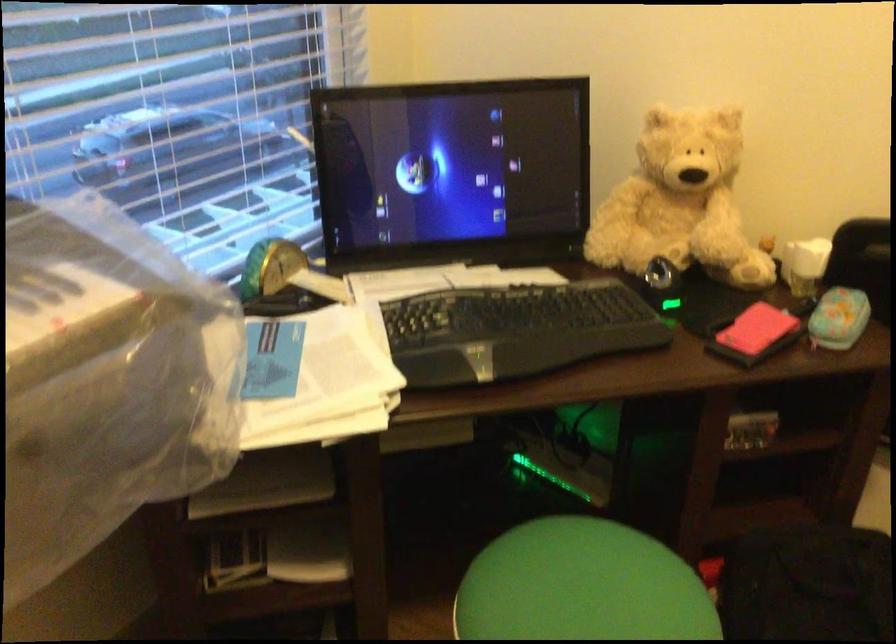
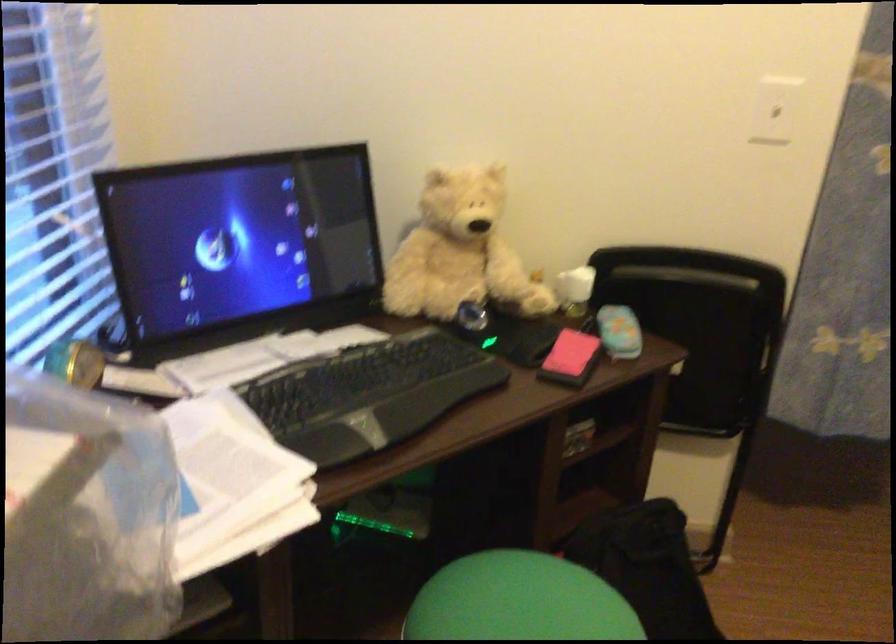
Question: The camera is either moving clockwise (left) or counter-clockwise (right) around the object. The first image is from the beginning of the video and the second image is from the end. Is the camera moving left or right when shooting the video?

Choices:
 (A) Left
 (B) Right

Answer: (A)